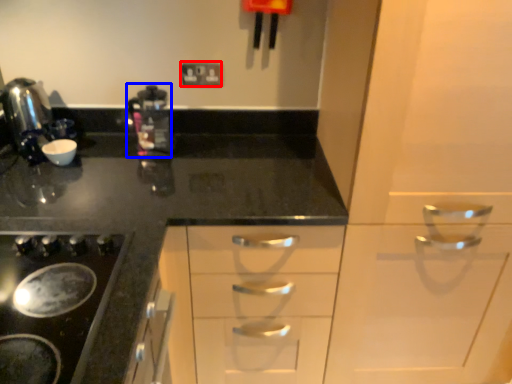
Question: Which point is closer to the camera, electric outlet (highlighted by a red box) or coffee machine (highlighted by a blue box)?

Choices:
 (A) electric outlet
 (B) coffee machine

Answer: (B)